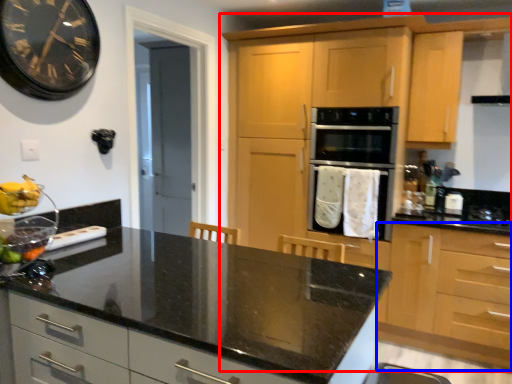
Question: Which object appears closest to the camera in this image, cabinetry (highlighted by a red box) or cabinetry (highlighted by a blue box)?

Choices:
 (A) cabinetry
 (B) cabinetry

Answer: (B)